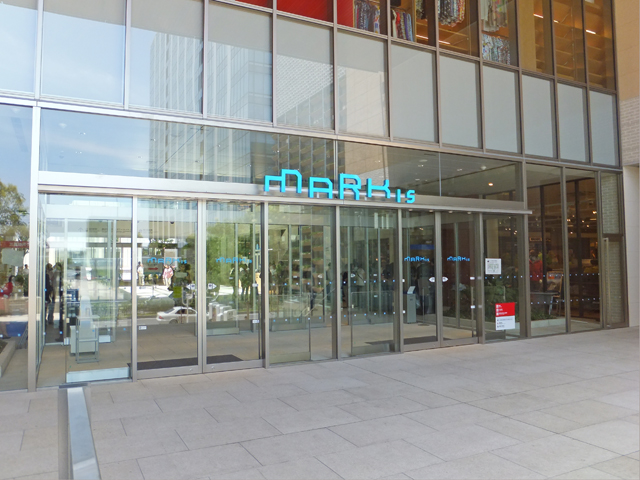
Image resolution: width=640 pixels, height=480 pixels. In order to click on multiple sliding glass doors in this screenshot , I will do `click(301, 296)`.